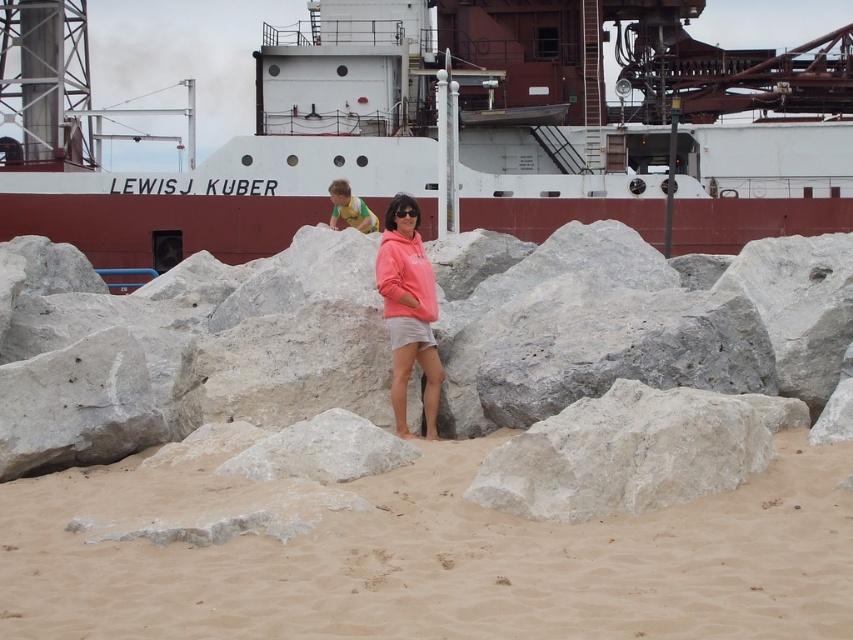
Question: Which point is closer to the camera taking this photo?

Choices:
 (A) (410, 282)
 (B) (712, 624)

Answer: (B)

Question: Which object appears closest to the camera in this image?

Choices:
 (A) white matte ship at upper center
 (B) beige sand at lower center

Answer: (B)

Question: Is white matte ship at upper center positioned behind beige sand at lower center?

Choices:
 (A) yes
 (B) no

Answer: (A)

Question: Is beige sand at lower center closer to camera compared to matte pink hoodie at center?

Choices:
 (A) no
 (B) yes

Answer: (B)

Question: Does white matte ship at upper center appear on the left side of beige sand at lower center?

Choices:
 (A) yes
 (B) no

Answer: (B)

Question: Which of the following is the closest to the observer?

Choices:
 (A) (399, 138)
 (B) (42, 552)

Answer: (B)